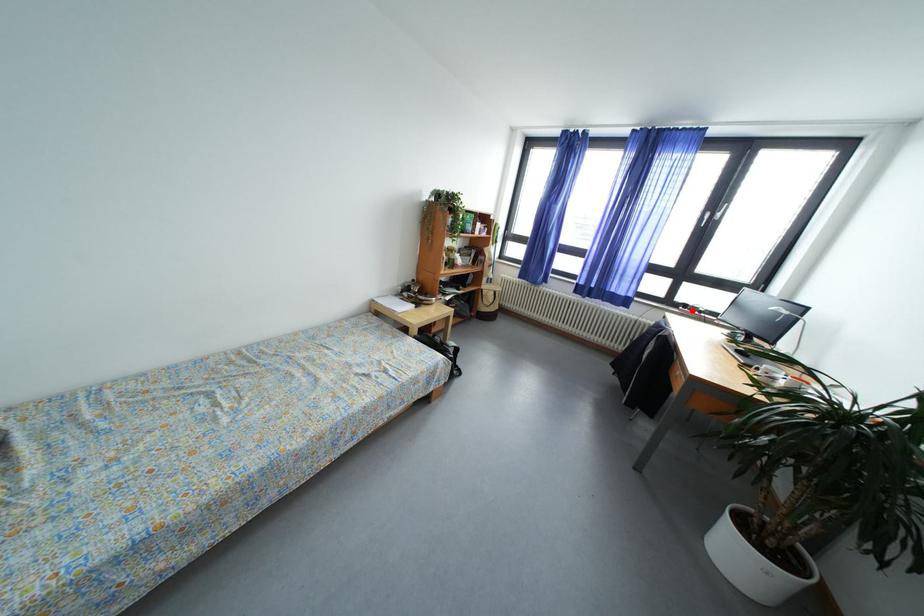
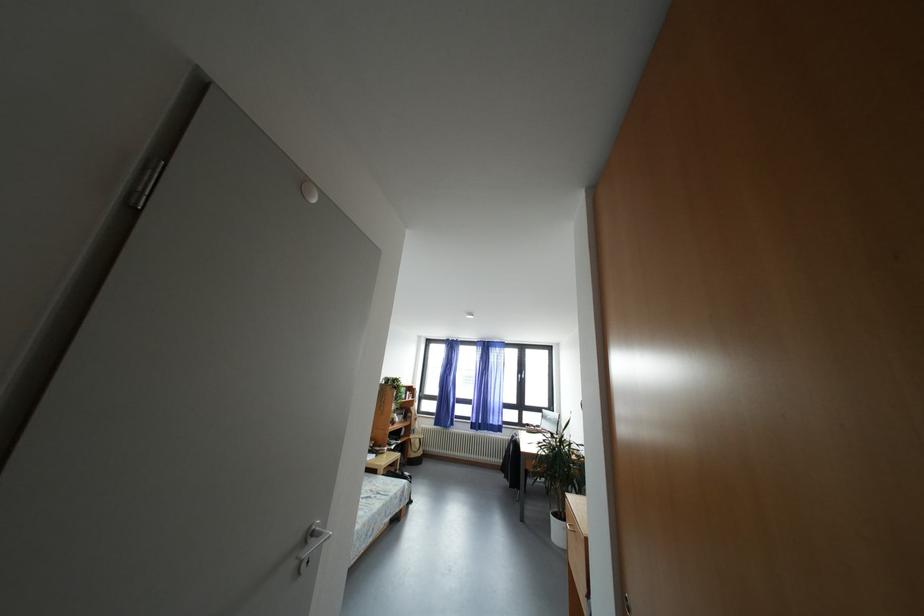
Where in the second image is the point corresponding to the highlighted location from the first image?

(533, 430)